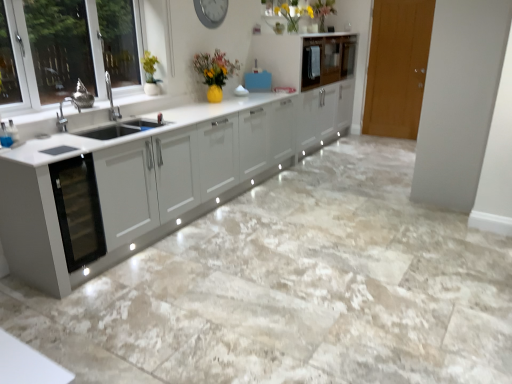
Question: From a real-world perspective, is matte yellow vase at upper center under metallic gray clock at upper center?

Choices:
 (A) no
 (B) yes

Answer: (B)

Question: Can you confirm if matte yellow vase at upper center is positioned to the left of metallic gray clock at upper center?

Choices:
 (A) no
 (B) yes

Answer: (A)

Question: Does matte yellow vase at upper center have a lesser height compared to metallic gray clock at upper center?

Choices:
 (A) no
 (B) yes

Answer: (A)

Question: From a real-world perspective, is matte yellow vase at upper center on metallic gray clock at upper center?

Choices:
 (A) no
 (B) yes

Answer: (A)

Question: From the image's perspective, does matte yellow vase at upper center appear higher than metallic gray clock at upper center?

Choices:
 (A) no
 (B) yes

Answer: (B)

Question: Do you think metallic gray clock at upper center is within wooden door at right, or outside of it?

Choices:
 (A) outside
 (B) inside

Answer: (A)

Question: Relative to wooden door at right, is metallic gray clock at upper center in front or behind?

Choices:
 (A) front
 (B) behind

Answer: (A)

Question: Looking at their shapes, would you say metallic gray clock at upper center is wider or thinner than wooden door at right?

Choices:
 (A) wide
 (B) thin

Answer: (B)

Question: From the image's perspective, is metallic gray clock at upper center above or below wooden door at right?

Choices:
 (A) above
 (B) below

Answer: (A)

Question: From the image's perspective, relative to wooden door at right, is glossy white cabinet at upper center, which is the 1th cabinetry from back to front, above or below?

Choices:
 (A) above
 (B) below

Answer: (A)

Question: Is glossy white cabinet at upper center, which is the 1th cabinetry from back to front, spatially inside wooden door at right, or outside of it?

Choices:
 (A) inside
 (B) outside

Answer: (B)

Question: Considering the positions of glossy white cabinet at upper center, which is the 1th cabinetry from back to front, and wooden door at right in the image, is glossy white cabinet at upper center, which is the 1th cabinetry from back to front, wider or thinner than wooden door at right?

Choices:
 (A) wide
 (B) thin

Answer: (A)

Question: From a real-world perspective, is glossy white cabinet at upper center, which is the 1th cabinetry from back to front, positioned above or below wooden door at right?

Choices:
 (A) below
 (B) above

Answer: (B)

Question: From the image's perspective, relative to metallic gray clock at upper center, is glossy wood cabinet at upper center, the 1th cabinetry when ordered from front to back, above or below?

Choices:
 (A) above
 (B) below

Answer: (B)

Question: Considering their positions, is glossy wood cabinet at upper center, the second cabinetry when ordered from back to front, located in front of or behind metallic gray clock at upper center?

Choices:
 (A) behind
 (B) front

Answer: (A)